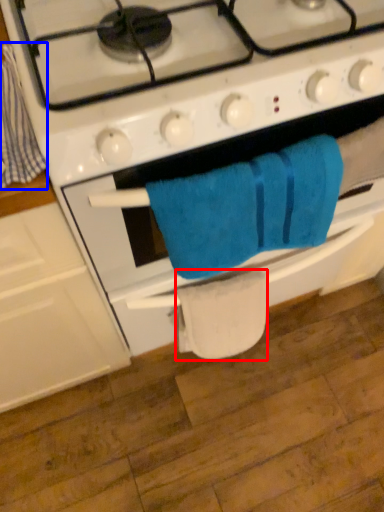
Question: Which point is closer to the camera, toilet paper (highlighted by a red box) or beach towel (highlighted by a blue box)?

Choices:
 (A) toilet paper
 (B) beach towel

Answer: (B)